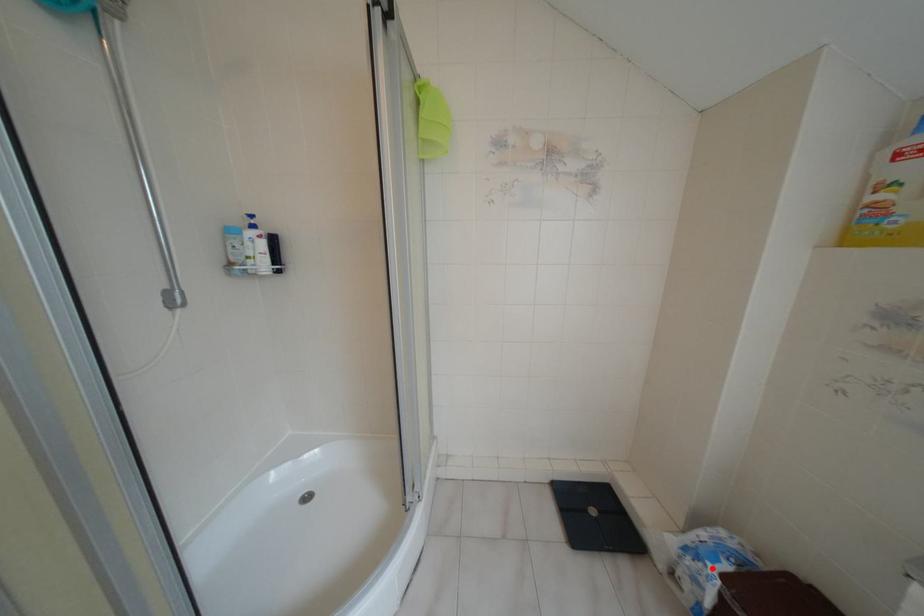
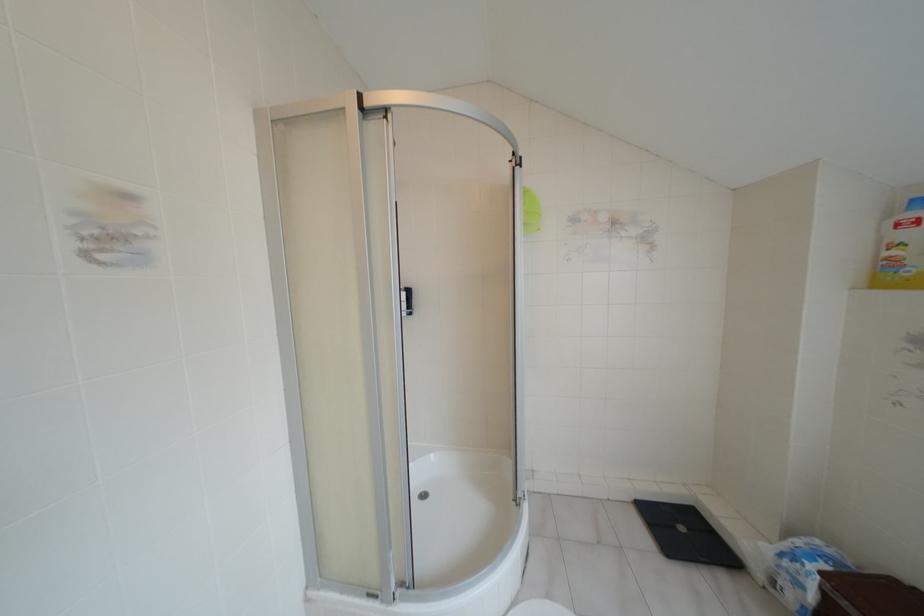
Find the pixel in the second image that matches the highlighted location in the first image.

(809, 565)